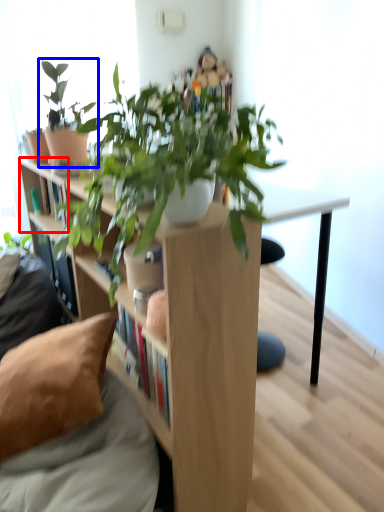
Question: Which object is closer to the camera taking this photo, shelf (highlighted by a red box) or houseplant (highlighted by a blue box)?

Choices:
 (A) shelf
 (B) houseplant

Answer: (B)